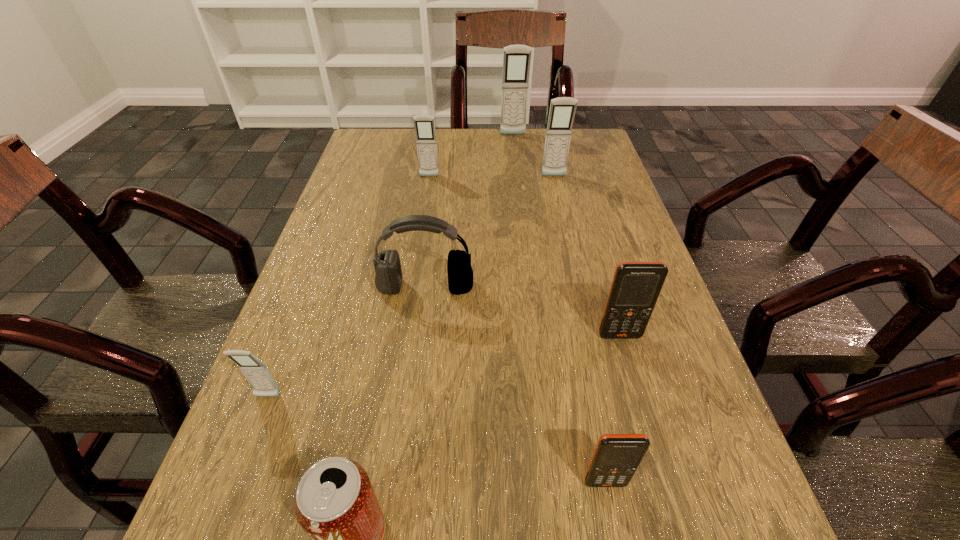
Where is `object that is at the far edge`? The height and width of the screenshot is (540, 960). object that is at the far edge is located at coordinates (516, 58).

Find the location of a particular element. This screenshot has width=960, height=540. headset located at the left edge is located at coordinates (388, 279).

This screenshot has height=540, width=960. I want to click on cellular telephone at the left edge, so click(x=257, y=374).

Find the location of a particular element. The height and width of the screenshot is (540, 960). vacant region at the far edge of the desktop is located at coordinates (446, 130).

Find the location of a particular element. The image size is (960, 540). vacant area at the left edge of the desktop is located at coordinates (330, 285).

This screenshot has height=540, width=960. Identify the location of free spot at the right edge of the desktop. (576, 265).

In the image, there is a desktop. Where is `vacant space at the far left corner`? vacant space at the far left corner is located at coordinates (406, 167).

Where is `vacant region at the far right corner of the desktop`? vacant region at the far right corner of the desktop is located at coordinates (598, 165).

Where is `vacant space that is in between the sixth farthest object and the fourth nearest object`? This screenshot has height=540, width=960. vacant space that is in between the sixth farthest object and the fourth nearest object is located at coordinates (444, 366).

Find the location of a particular element. unoccupied position between the third biggest gray cellular telephone and the fourth farthest object is located at coordinates (427, 232).